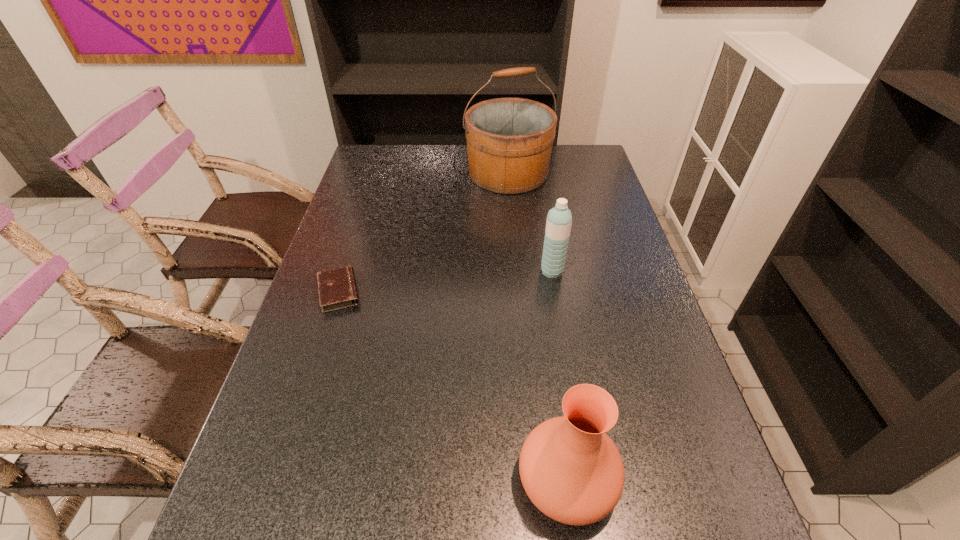
Locate an element on the screen. free spot between the tallest object and the nearest object is located at coordinates (538, 327).

This screenshot has height=540, width=960. Find the location of `vacant space in between the vase and the water bottle`. vacant space in between the vase and the water bottle is located at coordinates (560, 376).

Where is `free space that is in between the bucket and the water bottle`? The width and height of the screenshot is (960, 540). free space that is in between the bucket and the water bottle is located at coordinates (530, 222).

I want to click on free space between the vase and the tallest object, so click(538, 327).

This screenshot has width=960, height=540. I want to click on free spot between the farthest object and the water bottle, so pyautogui.click(x=530, y=222).

Where is `free point between the leftmost object and the water bottle`? This screenshot has width=960, height=540. free point between the leftmost object and the water bottle is located at coordinates (445, 281).

Locate an element on the screen. This screenshot has height=540, width=960. free space between the vase and the diary is located at coordinates (453, 386).

Find the location of a particular element. This screenshot has height=540, width=960. object that is the nearest to the tallest object is located at coordinates (559, 219).

Locate which object is the third closest to the bucket. Please provide its 2D coordinates. Your answer should be formatted as a tuple, i.e. [(x, y)], where the tuple contains the x and y coordinates of a point satisfying the conditions above.

[(571, 470)]

Where is `free spot that satisfies the following two spatial constraints: 1. on the back side of the water bottle; 2. on the left side of the shortest object`? Image resolution: width=960 pixels, height=540 pixels. free spot that satisfies the following two spatial constraints: 1. on the back side of the water bottle; 2. on the left side of the shortest object is located at coordinates (346, 271).